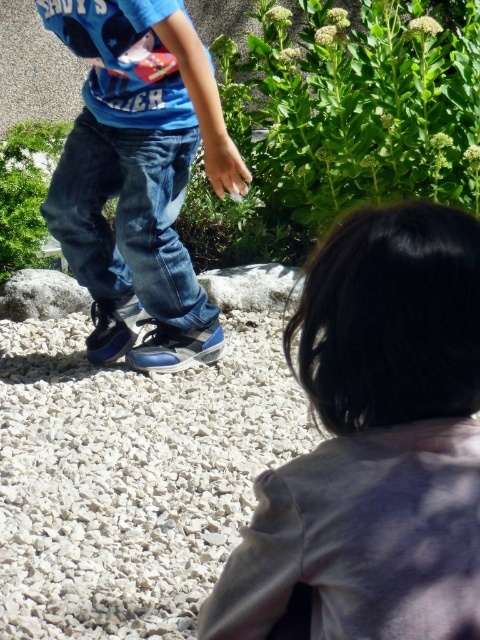
Is point (460, 440) positioned in front of point (162, 502)?

Yes, point (460, 440) is in front of point (162, 502).

Which is behind, point (434, 424) or point (167, 524)?

The point (167, 524) is more distant.

Who is more forward, (371, 372) or (215, 528)?

Point (371, 372)

This screenshot has height=640, width=480. What are the coordinates of `smooth gray shirt at lower right` in the screenshot? It's located at (373, 445).

Does white gravel at center lie in front of denim jeans at center?

Yes, white gravel at center is closer to the viewer.

Is white gravel at center shorter than denim jeans at center?

Correct, white gravel at center is not as tall as denim jeans at center.

Between point (240, 378) and point (181, 307), which one is positioned behind?

Positioned behind is point (240, 378).

You are a GUI agent. You are given a task and a screenshot of the screen. Output one action in this format:
    pyautogui.click(x=<x>, y=<y>)
    Task: Click on the white gravel at center
    This screenshot has width=480, height=640.
    Given the screenshot: What is the action you would take?
    click(x=131, y=477)

Is point (468, 240) positioned after point (171, 312)?

No, it is not.

Between smooth gray shirt at lower right and denim jeans at center, which one is positioned higher?

denim jeans at center

Who is more forward, (248, 620) or (146, 196)?

Point (248, 620) is in front.

The height and width of the screenshot is (640, 480). Find the location of `smooth gray shirt at lower right`. smooth gray shirt at lower right is located at coordinates (373, 445).